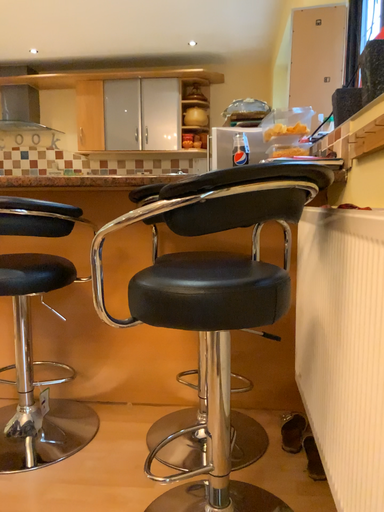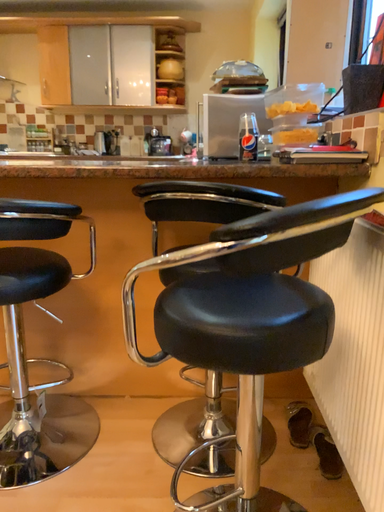
Question: Which way did the camera rotate in the video?

Choices:
 (A) rotated downward
 (B) rotated upward

Answer: (A)